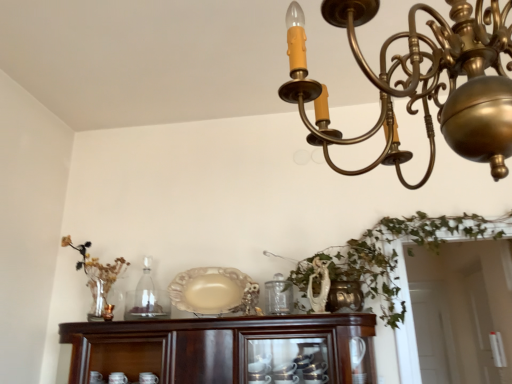
Question: From the image's perspective, is clear glass bottle at center below matte gold candle holder at left?

Choices:
 (A) no
 (B) yes

Answer: (A)

Question: Is clear glass bottle at center positioned with its back to matte gold candle holder at left?

Choices:
 (A) no
 (B) yes

Answer: (A)

Question: From a real-world perspective, is clear glass bottle at center on top of matte gold candle holder at left?

Choices:
 (A) yes
 (B) no

Answer: (A)

Question: Is clear glass bottle at center further to the viewer compared to matte gold candle holder at left?

Choices:
 (A) yes
 (B) no

Answer: (A)

Question: Can you confirm if clear glass bottle at center is smaller than matte gold candle holder at left?

Choices:
 (A) yes
 (B) no

Answer: (B)

Question: From a real-world perspective, relative to matte gold candle holder at left, is matte beige platter at center vertically above or below?

Choices:
 (A) below
 (B) above

Answer: (B)

Question: Is matte beige platter at center inside the boundaries of matte gold candle holder at left, or outside?

Choices:
 (A) outside
 (B) inside

Answer: (A)

Question: Considering the positions of matte beige platter at center and matte gold candle holder at left in the image, is matte beige platter at center wider or thinner than matte gold candle holder at left?

Choices:
 (A) wide
 (B) thin

Answer: (A)

Question: Considering the relative positions of matte beige platter at center and matte gold candle holder at left in the image provided, is matte beige platter at center to the left or to the right of matte gold candle holder at left?

Choices:
 (A) left
 (B) right

Answer: (B)

Question: Would you say matte gold candle holder at left is to the left or to the right of gold metallic chandelier at upper center in the picture?

Choices:
 (A) left
 (B) right

Answer: (A)

Question: Considering the positions of point (108, 321) and point (506, 3), is point (108, 321) closer or farther from the camera than point (506, 3)?

Choices:
 (A) farther
 (B) closer

Answer: (A)

Question: From their relative heights in the image, would you say matte gold candle holder at left is taller or shorter than gold metallic chandelier at upper center?

Choices:
 (A) short
 (B) tall

Answer: (A)

Question: From the image's perspective, is matte gold candle holder at left above or below gold metallic chandelier at upper center?

Choices:
 (A) below
 (B) above

Answer: (A)

Question: Considering the positions of clear glass bottle at center and matte gold candle holder at left in the image, is clear glass bottle at center bigger or smaller than matte gold candle holder at left?

Choices:
 (A) small
 (B) big

Answer: (B)

Question: Is clear glass bottle at center wider or thinner than matte gold candle holder at left?

Choices:
 (A) thin
 (B) wide

Answer: (B)